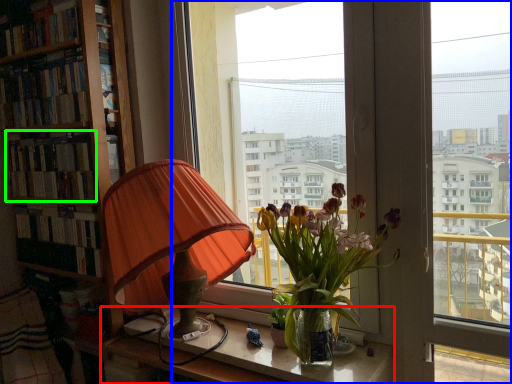
Question: Based on their relative distances, which object is farther from table (highlighted by a red box)? Choose from window (highlighted by a blue box) and book (highlighted by a green box).

Choices:
 (A) window
 (B) book

Answer: (B)